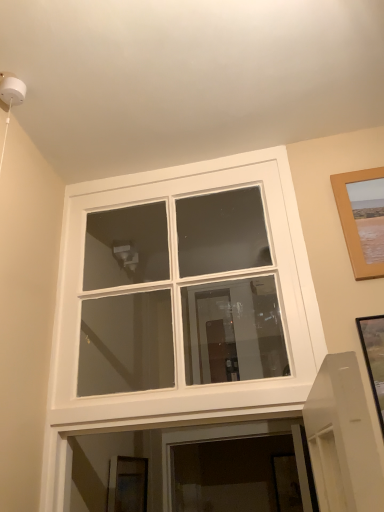
Question: Which direction should I rotate to look at wooden picture frame at lower center, acting as the 2th picture frame starting from the front?

Choices:
 (A) left
 (B) right

Answer: (A)

Question: From the image's perspective, does wooden picture frame at upper right, which ranks as the first picture frame in front-to-back order, appear lower than white glass window at center?

Choices:
 (A) yes
 (B) no

Answer: (B)

Question: Is wooden picture frame at upper right, which appears as the 2th picture frame when viewed from the back, at the right side of white glass window at center?

Choices:
 (A) yes
 (B) no

Answer: (A)

Question: From a real-world perspective, is wooden picture frame at upper right, the first picture frame from the right, under white glass window at center?

Choices:
 (A) no
 (B) yes

Answer: (A)

Question: From a real-world perspective, does wooden picture frame at upper right, the first picture frame from the right, stand above white glass window at center?

Choices:
 (A) yes
 (B) no

Answer: (A)

Question: Does wooden picture frame at upper right, which is counted as the second picture frame, starting from the bottom, have a greater height compared to white glass window at center?

Choices:
 (A) no
 (B) yes

Answer: (A)

Question: Is the position of wooden picture frame at upper right, arranged as the first picture frame when viewed from the top, less distant than that of white glass window at center?

Choices:
 (A) no
 (B) yes

Answer: (A)

Question: Is the position of white glass window at center less distant than that of wooden picture frame at upper right, arranged as the first picture frame when viewed from the top?

Choices:
 (A) no
 (B) yes

Answer: (B)

Question: Is white glass window at center facing away from wooden picture frame at upper right, which is counted as the second picture frame, starting from the bottom?

Choices:
 (A) no
 (B) yes

Answer: (A)

Question: Could you tell me if white glass window at center is facing wooden picture frame at upper right, which ranks as the first picture frame in front-to-back order?

Choices:
 (A) no
 (B) yes

Answer: (A)

Question: Is white glass window at center wider than wooden picture frame at upper right, which ranks as the first picture frame in front-to-back order?

Choices:
 (A) yes
 (B) no

Answer: (A)

Question: From a real-world perspective, is white glass window at center physically above wooden picture frame at upper right, which ranks as the first picture frame in front-to-back order?

Choices:
 (A) no
 (B) yes

Answer: (A)

Question: Is white glass window at center to the left of wooden picture frame at upper right, arranged as the first picture frame when viewed from the top, from the viewer's perspective?

Choices:
 (A) yes
 (B) no

Answer: (A)

Question: From a real-world perspective, is wooden picture frame at lower center, which ranks as the 1th picture frame in back-to-front order, positioned over wooden picture frame at upper right, which ranks as the first picture frame in front-to-back order, based on gravity?

Choices:
 (A) yes
 (B) no

Answer: (B)